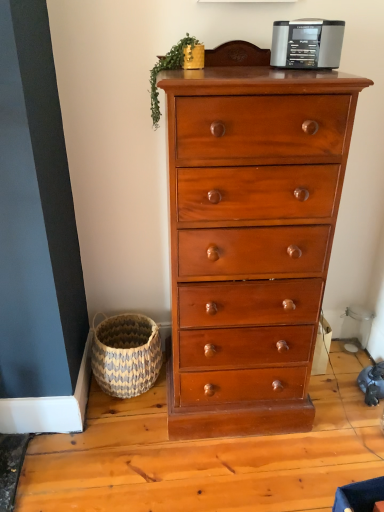
Question: Can you confirm if metallic gray radio at upper center is wider than green leafy plant at upper center?

Choices:
 (A) yes
 (B) no

Answer: (B)

Question: Is metallic gray radio at upper center not inside green leafy plant at upper center?

Choices:
 (A) no
 (B) yes

Answer: (B)

Question: Is metallic gray radio at upper center in contact with green leafy plant at upper center?

Choices:
 (A) yes
 (B) no

Answer: (B)

Question: From the image's perspective, does metallic gray radio at upper center appear higher than green leafy plant at upper center?

Choices:
 (A) yes
 (B) no

Answer: (A)

Question: Does metallic gray radio at upper center appear on the left side of green leafy plant at upper center?

Choices:
 (A) yes
 (B) no

Answer: (B)

Question: Is metallic gray radio at upper center oriented towards green leafy plant at upper center?

Choices:
 (A) no
 (B) yes

Answer: (A)

Question: Is shiny brown wood chest of drawers at center not within metallic gray radio at upper center?

Choices:
 (A) yes
 (B) no

Answer: (A)

Question: Does shiny brown wood chest of drawers at center have a smaller size compared to metallic gray radio at upper center?

Choices:
 (A) yes
 (B) no

Answer: (B)

Question: From a real-world perspective, is shiny brown wood chest of drawers at center over metallic gray radio at upper center?

Choices:
 (A) no
 (B) yes

Answer: (A)

Question: Does shiny brown wood chest of drawers at center turn towards metallic gray radio at upper center?

Choices:
 (A) no
 (B) yes

Answer: (A)

Question: Does shiny brown wood chest of drawers at center have a larger size compared to metallic gray radio at upper center?

Choices:
 (A) no
 (B) yes

Answer: (B)

Question: Considering the relative sizes of shiny brown wood chest of drawers at center and metallic gray radio at upper center in the image provided, is shiny brown wood chest of drawers at center shorter than metallic gray radio at upper center?

Choices:
 (A) no
 (B) yes

Answer: (A)

Question: From a real-world perspective, is woven natural basket at lower left on top of shiny brown wood chest of drawers at center?

Choices:
 (A) no
 (B) yes

Answer: (A)